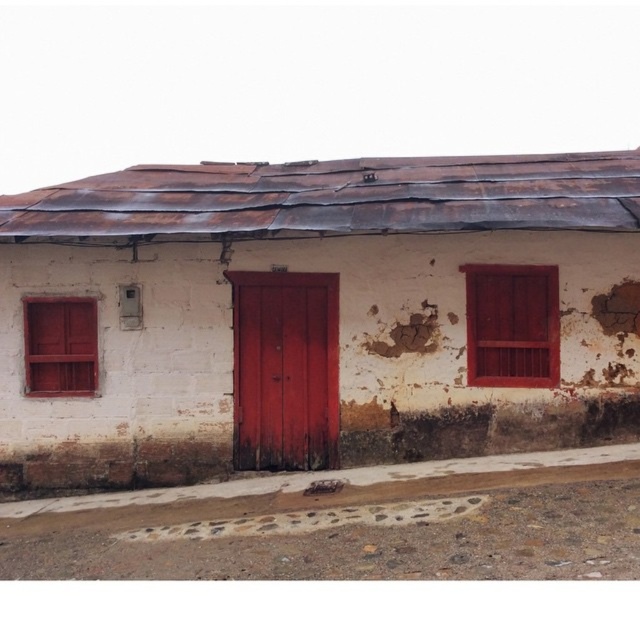
Does wooden at right have a greater height compared to matte wood shutter at left?

Yes, wooden at right is taller than matte wood shutter at left.

Does wooden at right have a lesser height compared to matte wood shutter at left?

In fact, wooden at right may be taller than matte wood shutter at left.

The image size is (640, 640). Describe the element at coordinates (512, 324) in the screenshot. I see `wooden at right` at that location.

Identify the location of wooden at right. The image size is (640, 640). (512, 324).

Between smooth glossy wood door at center and wooden at right, which one has less height?

Standing shorter between the two is wooden at right.

Can you confirm if smooth glossy wood door at center is thinner than wooden at right?

No, smooth glossy wood door at center is not thinner than wooden at right.

Where is `smooth glossy wood door at center`? The height and width of the screenshot is (640, 640). smooth glossy wood door at center is located at coordinates (284, 369).

The width and height of the screenshot is (640, 640). Identify the location of smooth wooden door at center. (324, 314).

Between smooth wooden door at center and smooth glossy wood door at center, which one has less height?

smooth glossy wood door at center is shorter.

Which is behind, point (536, 198) or point (273, 300)?

Positioned behind is point (273, 300).

Locate an element on the screen. The width and height of the screenshot is (640, 640). smooth wooden door at center is located at coordinates (324, 314).